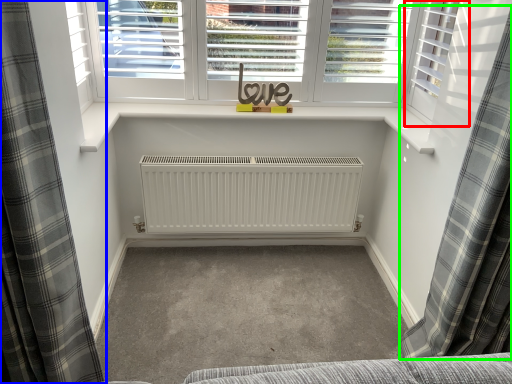
Question: Estimate the real-world distances between objects in this image. Which object is farther from shutter (highlighted by a red box), curtain (highlighted by a blue box) or curtain (highlighted by a green box)?

Choices:
 (A) curtain
 (B) curtain

Answer: (A)